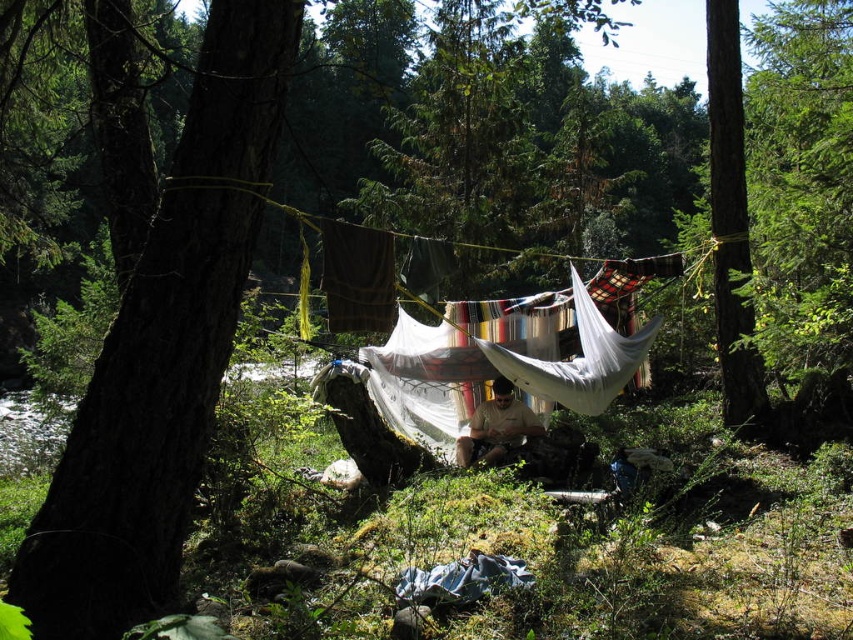
Is point (262, 17) farther from camera compared to point (735, 157)?

No.

The height and width of the screenshot is (640, 853). I want to click on brown rough bark tree at left, so click(163, 349).